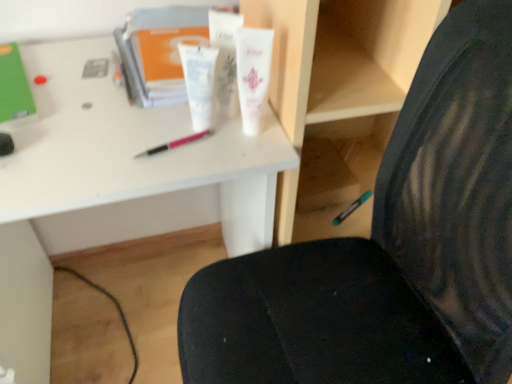
You are a GUI agent. You are given a task and a screenshot of the screen. Output one action in this format:
    pyautogui.click(x=<x>, y=<y>)
    Task: Click on the free spot to the left of white matte tube at center, positioned as the first toiletry in right-to-left order
    
    Given the screenshot: What is the action you would take?
    pyautogui.click(x=146, y=133)